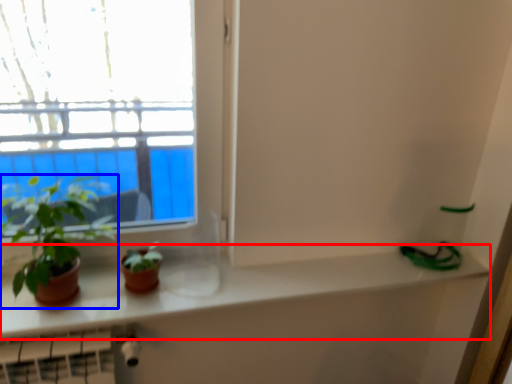
Question: Which object appears closest to the camera in this image, counter top (highlighted by a red box) or houseplant (highlighted by a blue box)?

Choices:
 (A) counter top
 (B) houseplant

Answer: (B)